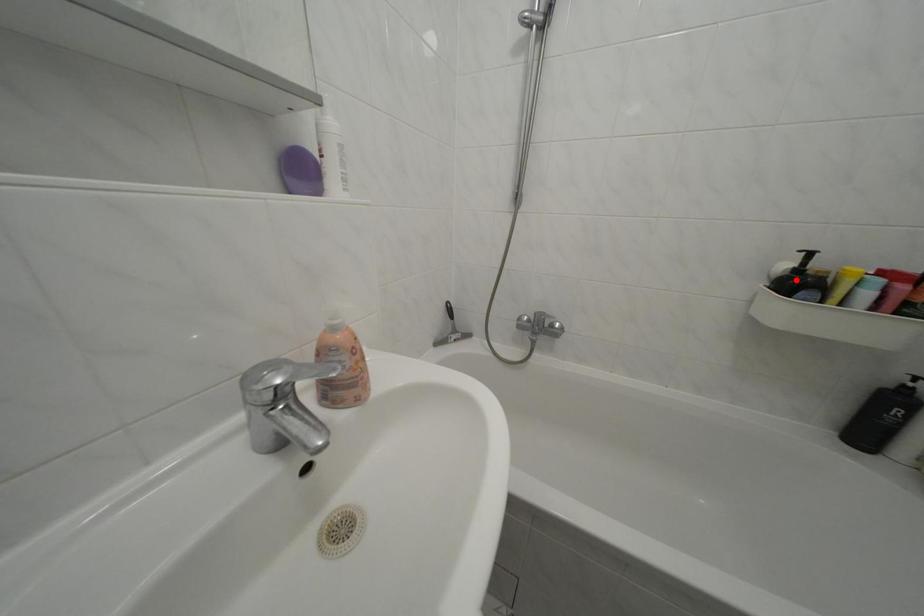
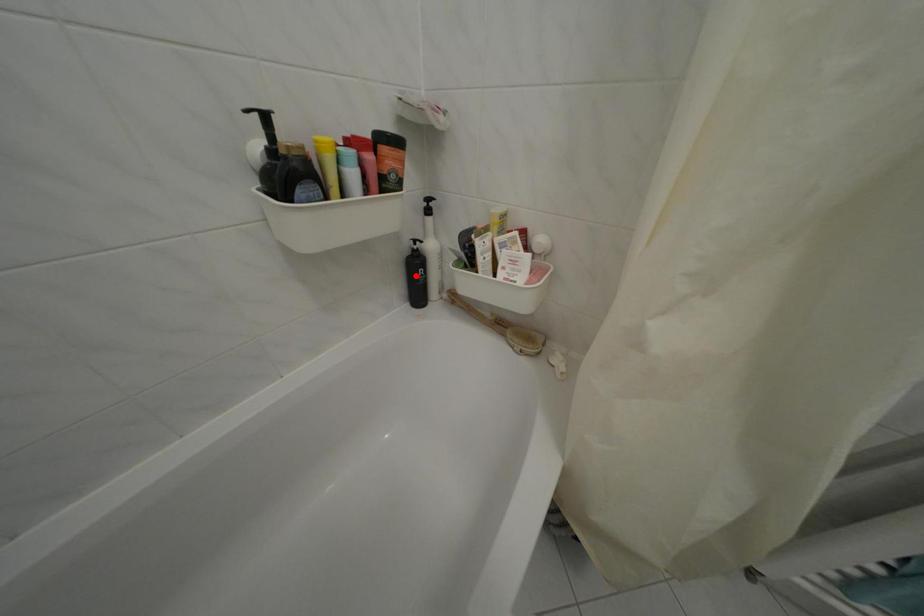
I am providing you with two images of the same scene from different viewpoints. A red point is marked on the first image and another point is marked on the second image. Is the red point in image1 aligned with the point shown in image2?

No